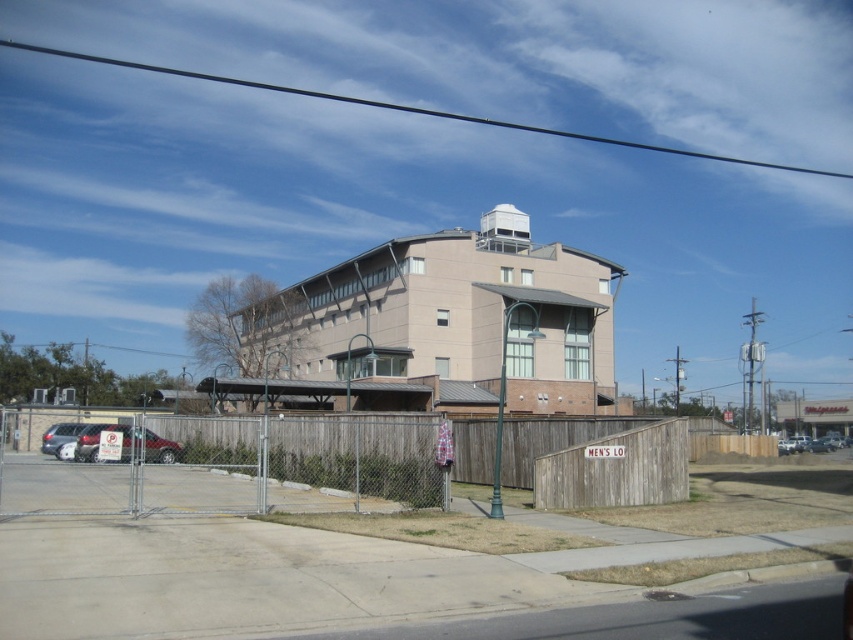
You are standing in front of the building and want to enter the parking lot. Where is the open section of the metal chain link fence at lower center located relative to the point marked at coordinate (x=235, y=467)?

The point marked at coordinate (x=235, y=467) corresponds to the metal chain link fence at lower center, so the open section is located at that point.

You are standing in front of the building and want to reach the point at coordinates point (331, 476). The fence has an opening that is 6 feet wide. Can you walk through the opening to reach the point?

The point (331, 476) is 65.63 feet away from the camera. Since the opening in the fence is only 6 feet wide, you would need to navigate through the narrow opening to reach the point, but the distance to the point is much greater than the opening width. The width of the opening is not a barrier to reaching the point as it only restricts lateral passage, not the distance required to walk forward to the point.

You are standing in front of the building and want to walk towards the two points marked on the ground. Which point would you reach first, point (132,454) or point (149,435)?

You would reach point (132,454) first because it is closer to the viewer than point (149,435).